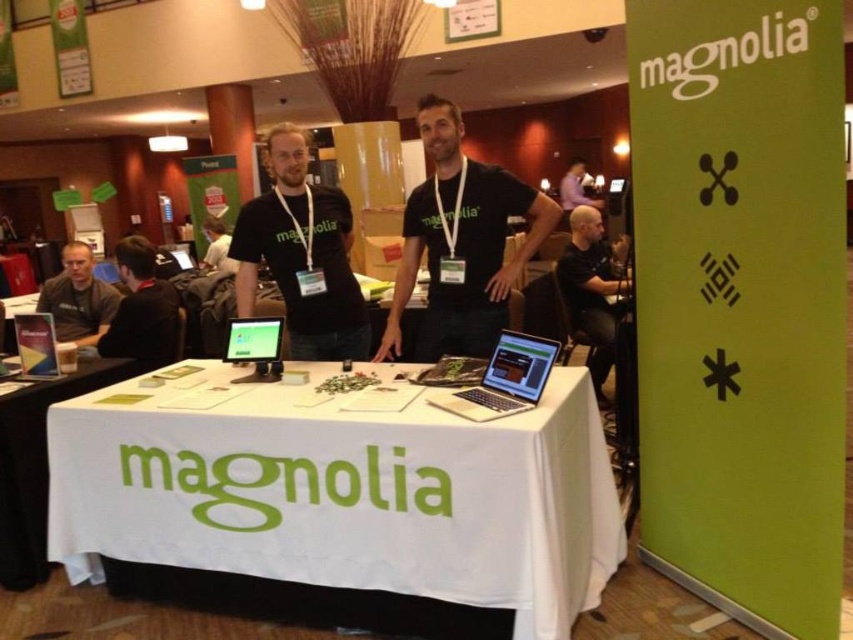
Is black matte shirt at right thinner than metallic silver laptop at center?

Incorrect, black matte shirt at right's width is not less than metallic silver laptop at center's.

Does point (602, 291) lie behind point (16, 326)?

Yes, it is behind point (16, 326).

This screenshot has width=853, height=640. Identify the location of black matte shirt at right. (593, 288).

From the picture: Can you confirm if silver metallic laptop at center is positioned to the left of black fabric shirt at center?

No, silver metallic laptop at center is not to the left of black fabric shirt at center.

Does point (512, 385) lie behind point (207, 266)?

No.

Locate an element on the screen. This screenshot has height=640, width=853. silver metallic laptop at center is located at coordinates (503, 380).

Does black matte t-shirt at center appear under metallic silver laptop at center?

Actually, black matte t-shirt at center is above metallic silver laptop at center.

Find the location of a particular element. This screenshot has height=640, width=853. black matte t-shirt at center is located at coordinates (461, 241).

Find the location of `black matte t-shirt at center`. black matte t-shirt at center is located at coordinates (461, 241).